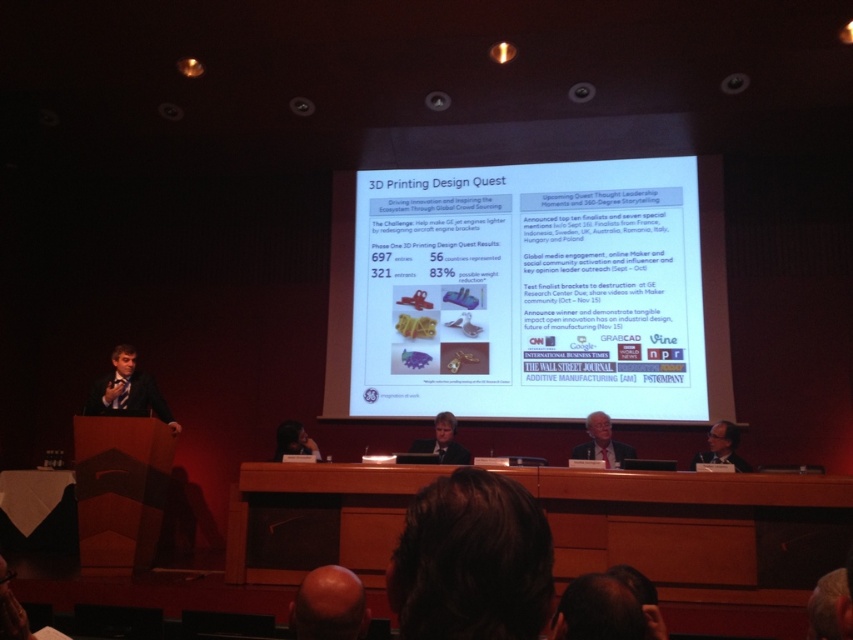
Question: Is the position of smooth black suit at center less distant than that of matte black glasses at upper right?

Choices:
 (A) no
 (B) yes

Answer: (A)

Question: Which is farther from the gray fabric suit at center?

Choices:
 (A) smooth black suit at center
 (B) bald head at lower center
 (C) dark brown leather chair at lower center
 (D) white matte projector screen at upper center

Answer: (B)

Question: Which of the following is the closest to the observer?

Choices:
 (A) (102, 403)
 (B) (605, 262)
 (C) (321, 595)

Answer: (C)

Question: Does bald head at lower center appear on the left side of dark brown leather chair at lower center?

Choices:
 (A) no
 (B) yes

Answer: (A)

Question: Is white matte projector screen at upper center wider than smooth black suit at center?

Choices:
 (A) no
 (B) yes

Answer: (B)

Question: Among these objects, which one is nearest to the camera?

Choices:
 (A) dark suit at left
 (B) dark brown leather chair at lower center

Answer: (A)